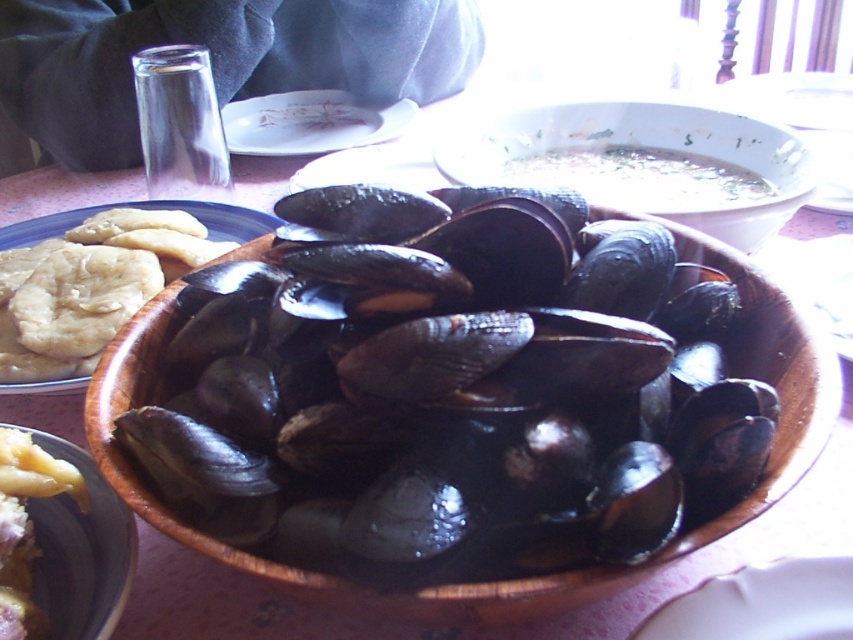
You are arranging a dinner party and want to place the matte yellow flatbread at left closer to the matte ceramic bowl at center. However, you need to ensure that the flatbread does not block the view of the bowl from the guest seated directly in front of the table. Can you move the flatbread to a position where it is still visible from that angle but closer to the bowl?

The matte yellow flatbread at left is currently positioned over the matte ceramic bowl at center. Moving it closer would require placing it in front of or beside the bowl, but since it is already over the bowl, moving it closer might block the view. A better option is to place it slightly to the side of the bowl so it remains visible while being near the bowl.

You are a guest at a dinner party and want to reach for the bread on the plate to your left. As you extend your arm across the table, will your hand pass in front of the translucent glass bowl at center or the matte ceramic bowl at center first?

Your hand will first pass in front of the translucent glass bowl at center because the matte ceramic bowl at center is positioned behind it.

You are a chef preparing a dish and need to choose between the translucent glass bowl at center and the matte ceramic bowl at center. Which bowl is taller?

The translucent glass bowl at center is much taller than the matte ceramic bowl at center.